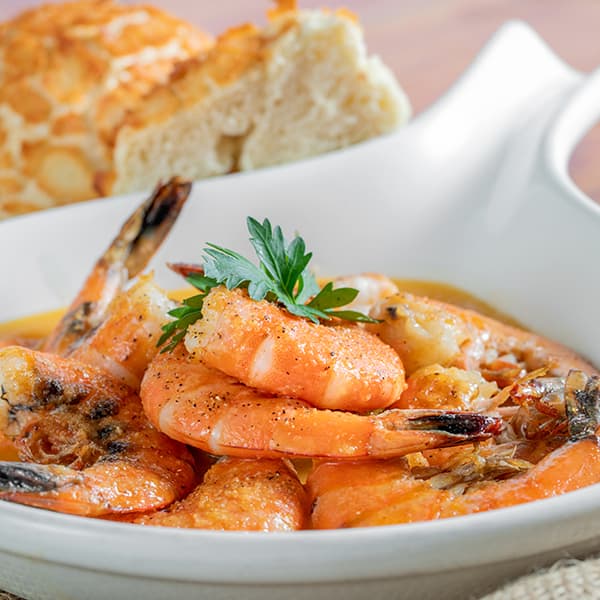
Where is `white soup bowl`? white soup bowl is located at coordinates (466, 194).